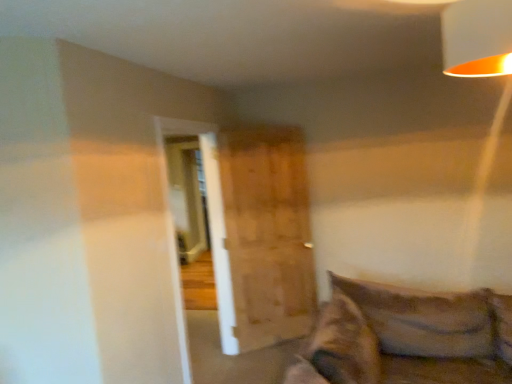
Question: Considering the positions of point [x=461, y=72] and point [x=306, y=284], is point [x=461, y=72] closer or farther from the camera than point [x=306, y=284]?

Choices:
 (A) closer
 (B) farther

Answer: (A)

Question: Visually, is orange matte lampshade at upper right positioned to the left or to the right of wooden barn door at center?

Choices:
 (A) right
 (B) left

Answer: (A)

Question: In terms of size, does orange matte lampshade at upper right appear bigger or smaller than wooden barn door at center?

Choices:
 (A) big
 (B) small

Answer: (B)

Question: From the image's perspective, relative to orange matte lampshade at upper right, is wooden barn door at center above or below?

Choices:
 (A) above
 (B) below

Answer: (B)

Question: Considering the positions of wooden barn door at center and orange matte lampshade at upper right in the image, is wooden barn door at center bigger or smaller than orange matte lampshade at upper right?

Choices:
 (A) big
 (B) small

Answer: (A)

Question: Considering the relative positions of wooden barn door at center and orange matte lampshade at upper right in the image provided, is wooden barn door at center to the left or to the right of orange matte lampshade at upper right?

Choices:
 (A) left
 (B) right

Answer: (A)

Question: From a real-world perspective, is wooden barn door at center physically located above or below orange matte lampshade at upper right?

Choices:
 (A) above
 (B) below

Answer: (B)